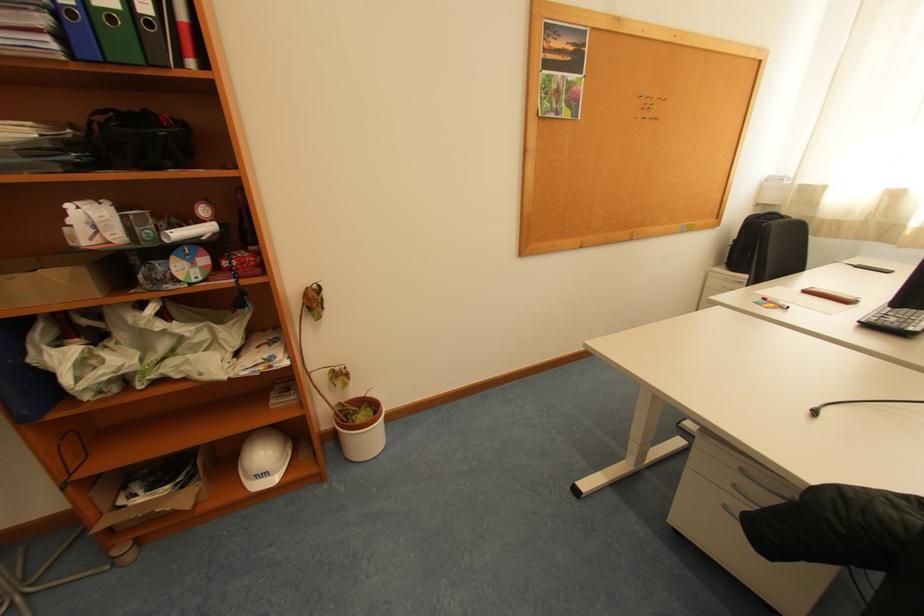
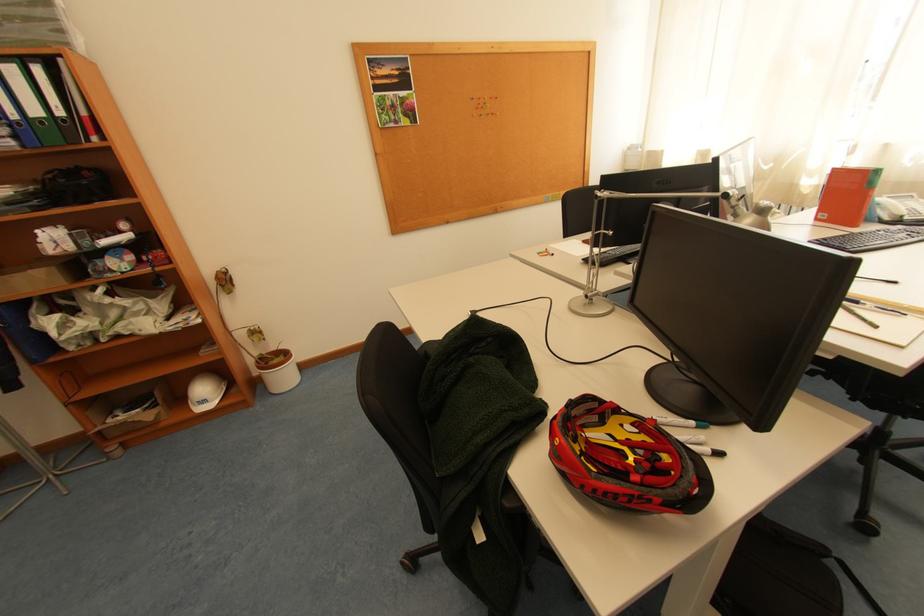
Locate, in the second image, the point that corresponds to (68,38) in the first image.

(23, 139)